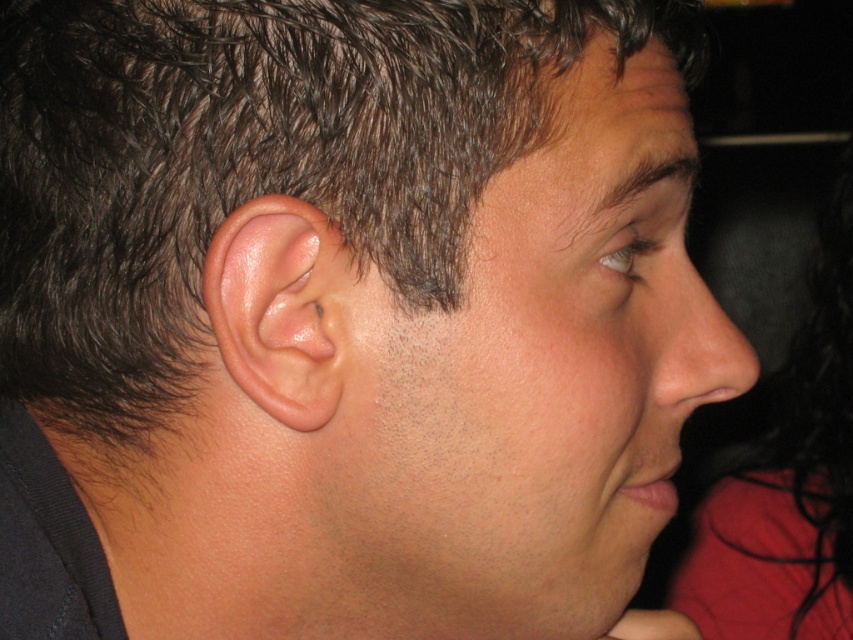
Looking at this image, you are a photographer adjusting lighting for a portrait. You need to ensure the dark brown hair at upper left and the smooth skin nose at center are both visible. Which object should you focus on first to adjust the lighting, considering their relative heights?

The dark brown hair at upper left has a greater height compared to the smooth skin nose at center, so you should focus on adjusting the lighting for the dark brown hair at upper left first to ensure proper visibility.